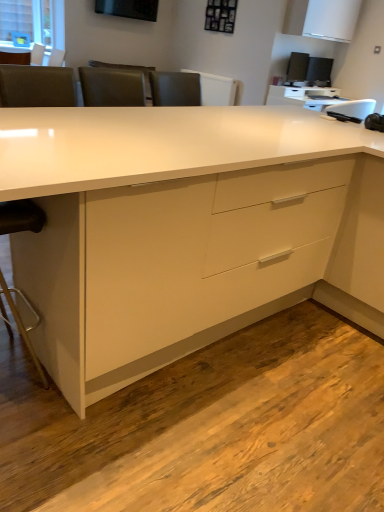
Measure the distance between point (9, 297) and camera.

5.64 feet.

At what (x,y) coordinates should I click in order to perform the action: click on white glossy computer desk at upper right. Please return your answer as a coordinate pair (x, y). Looking at the image, I should click on (304, 96).

The width and height of the screenshot is (384, 512). What do you see at coordinates (322, 19) in the screenshot?
I see `white glossy cabinet at upper right` at bounding box center [322, 19].

Describe the element at coordinates (309, 69) in the screenshot. I see `black plastic desktop computer at upper right` at that location.

You are a GUI agent. You are given a task and a screenshot of the screen. Output one action in this format:
    pyautogui.click(x=<x>, y=<y>)
    Task: Click on the black leather swivel chair at left
    This screenshot has height=512, width=384.
    Given the screenshot: What is the action you would take?
    pyautogui.click(x=21, y=217)

Consider the image. Would you say white glossy computer desk at upper right contains black leather swivel chair at left?

No, black leather swivel chair at left is located outside of white glossy computer desk at upper right.

Considering the sizes of objects white glossy computer desk at upper right and black leather swivel chair at left in the image provided, who is thinner, white glossy computer desk at upper right or black leather swivel chair at left?

With smaller width is black leather swivel chair at left.

Is white glossy computer desk at upper right touching black leather swivel chair at left?

There is a gap between white glossy computer desk at upper right and black leather swivel chair at left.

Would you say black leather swivel chair at left contains white glossy computer desk at upper right?

No, white glossy computer desk at upper right is located outside of black leather swivel chair at left.

Is black leather swivel chair at left oriented away from white glossy computer desk at upper right?

No, white glossy computer desk at upper right is not at the back of black leather swivel chair at left.

In terms of size, does black leather swivel chair at left appear bigger or smaller than white glossy computer desk at upper right?

Considering their sizes, black leather swivel chair at left takes up less space than white glossy computer desk at upper right.

Can you confirm if black leather swivel chair at left is positioned to the right of white glossy cabinet at upper right?

In fact, black leather swivel chair at left is to the left of white glossy cabinet at upper right.

I want to click on cabinetry above the black leather swivel chair at left (from a real-world perspective), so click(x=322, y=19).

From the image's perspective, which is above, black leather swivel chair at left or white glossy cabinet at upper right?

From the image's view, white glossy cabinet at upper right is above.

From a real-world perspective, between black leather swivel chair at left and white glossy cabinet at upper right, who is vertically higher?

white glossy cabinet at upper right is physically above.

Would you say black plastic desktop computer at upper right is to the left or to the right of white glossy computer desk at upper right in the picture?

In the image, black plastic desktop computer at upper right appears on the right side of white glossy computer desk at upper right.

Between black plastic desktop computer at upper right and white glossy computer desk at upper right, which one has less height?

white glossy computer desk at upper right is shorter.

From a real-world perspective, is black plastic desktop computer at upper right above or below white glossy computer desk at upper right?

From a real-world perspective, black plastic desktop computer at upper right is physically above white glossy computer desk at upper right.

Is black plastic desktop computer at upper right in front of white glossy computer desk at upper right?

No, the depth of black plastic desktop computer at upper right is greater than that of white glossy computer desk at upper right.

How distant is white glossy cabinet at upper right from white glossy computer desk at upper right?

The distance of white glossy cabinet at upper right from white glossy computer desk at upper right is 83.49 centimeters.

Is point (350, 4) farther from viewer compared to point (275, 99)?

No.

Considering the sizes of objects white glossy cabinet at upper right and white glossy computer desk at upper right in the image provided, who is smaller, white glossy cabinet at upper right or white glossy computer desk at upper right?

With smaller size is white glossy cabinet at upper right.

Is white glossy cabinet at upper right not close to white glossy computer desk at upper right?

Actually, white glossy cabinet at upper right and white glossy computer desk at upper right are a little close together.

Which object is thinner, black plastic desktop computer at upper right or white glossy cabinet at upper right?

Thinner between the two is black plastic desktop computer at upper right.

Between black plastic desktop computer at upper right and white glossy cabinet at upper right, which one has smaller size?

With smaller size is black plastic desktop computer at upper right.

From the image's perspective, is black plastic desktop computer at upper right on white glossy cabinet at upper right?

No.

Is black plastic desktop computer at upper right oriented away from white glossy cabinet at upper right?

No, black plastic desktop computer at upper right is not facing the opposite direction of white glossy cabinet at upper right.

Is black plastic desktop computer at upper right aimed at black leather swivel chair at left?

No, black plastic desktop computer at upper right is not aimed at black leather swivel chair at left.

Which is less distant, (332, 64) or (19, 223)?

Point (332, 64) is positioned farther from the camera compared to point (19, 223).

Is black plastic desktop computer at upper right touching black leather swivel chair at left?

No.

Does black plastic desktop computer at upper right have a greater width compared to black leather swivel chair at left?

In fact, black plastic desktop computer at upper right might be narrower than black leather swivel chair at left.

Identify the location of computer desk above the black leather swivel chair at left (from a real-world perspective). (304, 96).

Locate an element on the screen. computer desk above the black leather swivel chair at left (from the image's perspective) is located at coordinates (304, 96).

Looking at the image, which one is located closer to black plastic desktop computer at upper right, black leather swivel chair at left or white glossy computer desk at upper right?

white glossy computer desk at upper right lies closer to black plastic desktop computer at upper right than the other object.

Estimate the real-world distances between objects in this image. Which object is closer to white glossy computer desk at upper right, white glossy desk at center or black plastic desktop computer at upper right?

Based on the image, black plastic desktop computer at upper right appears to be nearer to white glossy computer desk at upper right.

Considering their positions, is black plastic desktop computer at upper right positioned further to black leather swivel chair at left than white glossy computer desk at upper right?

black plastic desktop computer at upper right lies further to black leather swivel chair at left than the other object.

Looking at the image, which one is located closer to white glossy computer desk at upper right, black leather swivel chair at left or white glossy desk at center?

The object closer to white glossy computer desk at upper right is white glossy desk at center.

From the image, which object appears to be nearer to black plastic desktop computer at upper right, white glossy desk at center or white glossy computer desk at upper right?

Based on the image, white glossy computer desk at upper right appears to be nearer to black plastic desktop computer at upper right.

Consider the image. Considering their positions, is white glossy computer desk at upper right positioned closer to white glossy cabinet at upper right than black plastic desktop computer at upper right?

white glossy computer desk at upper right lies closer to white glossy cabinet at upper right than the other object.

Consider the image. From the image, which object appears to be nearer to black leather swivel chair at left, black plastic desktop computer at upper right or white glossy desk at center?

white glossy desk at center.

Which object lies further to the anchor point white glossy computer desk at upper right, black plastic desktop computer at upper right or black leather swivel chair at left?

black leather swivel chair at left lies further to white glossy computer desk at upper right than the other object.

Find the location of a particular element. The width and height of the screenshot is (384, 512). cabinetry positioned between black leather swivel chair at left and black plastic desktop computer at upper right from near to far is located at coordinates (322, 19).

Where is `swivel chair between white glossy desk at center and white glossy cabinet at upper right in the front-back direction`? The width and height of the screenshot is (384, 512). swivel chair between white glossy desk at center and white glossy cabinet at upper right in the front-back direction is located at coordinates (21, 217).

At what (x,y) coordinates should I click in order to perform the action: click on computer desk between white glossy desk at center and black plastic desktop computer at upper right along the z-axis. Please return your answer as a coordinate pair (x, y). Looking at the image, I should click on (304, 96).

This screenshot has height=512, width=384. Find the location of `cabinetry between black leather swivel chair at left and white glossy computer desk at upper right from front to back`. cabinetry between black leather swivel chair at left and white glossy computer desk at upper right from front to back is located at coordinates (322, 19).